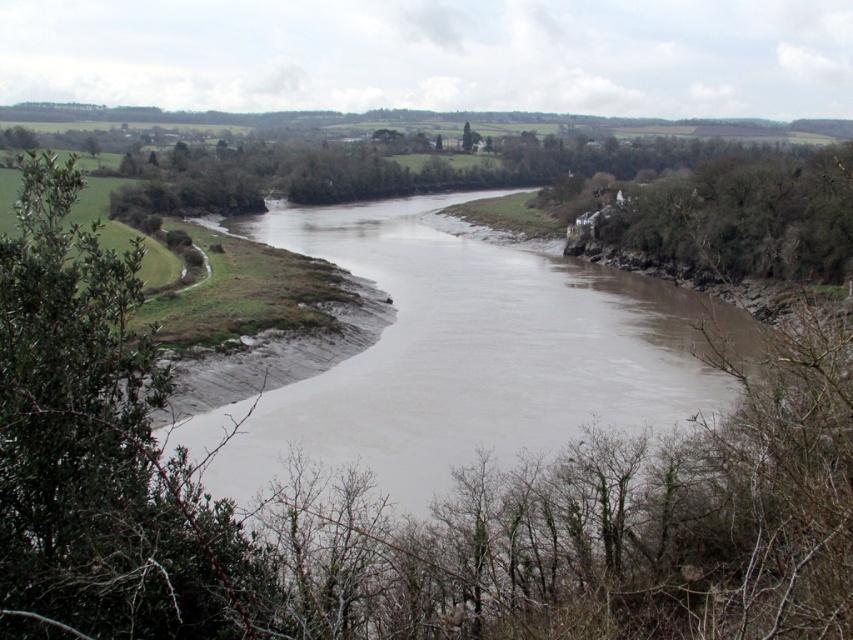
Question: Which point is farther to the camera?

Choices:
 (A) (178, 572)
 (B) (228, 451)

Answer: (B)

Question: Among these points, which one is farthest from the camera?

Choices:
 (A) (18, 365)
 (B) (583, 289)

Answer: (B)

Question: Which point appears farthest from the camera in this image?

Choices:
 (A) (250, 476)
 (B) (196, 632)

Answer: (A)

Question: Is muddy water at center positioned at the back of green leafy bush at left?

Choices:
 (A) yes
 (B) no

Answer: (A)

Question: Can you confirm if muddy water at center is positioned to the right of green leafy bush at left?

Choices:
 (A) no
 (B) yes

Answer: (B)

Question: Is the position of muddy water at center more distant than that of green leafy bush at left?

Choices:
 (A) no
 (B) yes

Answer: (B)